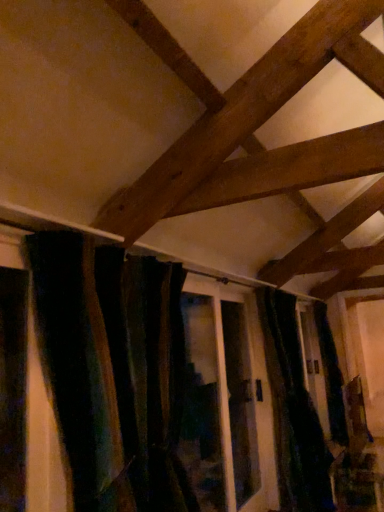
You are a GUI agent. You are given a task and a screenshot of the screen. Output one action in this format:
    pyautogui.click(x=<x>, y=<y>)
    Task: Click on the translucent glass screen door at center
    The width and height of the screenshot is (384, 512).
    Given the screenshot: What is the action you would take?
    pyautogui.click(x=226, y=401)

Describe the element at coordinates (226, 401) in the screenshot. I see `translucent glass screen door at center` at that location.

What is the approximate width of velvet dark green curtain at center, which is the second curtain in left-to-right order?

19.96 inches.

Locate an element on the screen. The width and height of the screenshot is (384, 512). translucent glass screen door at center is located at coordinates (226, 401).

Between velvet dark green curtain at center, the first curtain when ordered from left to right, and translucent glass screen door at center, which one has larger width?

With larger width is velvet dark green curtain at center, the first curtain when ordered from left to right.

From a real-world perspective, does velvet dark green curtain at center, the first curtain when ordered from left to right, sit lower than translucent glass screen door at center?

No, from a real-world perspective, velvet dark green curtain at center, the first curtain when ordered from left to right, is not beneath translucent glass screen door at center.

From the image's perspective, is velvet dark green curtain at center, the first curtain when ordered from left to right, positioned above or below translucent glass screen door at center?

Clearly, from the image's perspective, velvet dark green curtain at center, the first curtain when ordered from left to right, is above translucent glass screen door at center.

Find the location of a particular element. The image size is (384, 512). screen door beneath the velvet dark green curtain at center, the 1th curtain positioned from the front (from a real-world perspective) is located at coordinates (226, 401).

Is velvet dark green curtain at center, which ranks as the first curtain in back-to-front order, far away from velvet dark green curtain at center, which is the 2th curtain from back to front?

velvet dark green curtain at center, which ranks as the first curtain in back-to-front order, is positioned a significant distance from velvet dark green curtain at center, which is the 2th curtain from back to front.

From the picture: Which object is more forward, velvet dark green curtain at center, acting as the second curtain starting from the front, or velvet dark green curtain at center, the first curtain when ordered from left to right?

velvet dark green curtain at center, the first curtain when ordered from left to right, is closer to the camera.

Who is smaller, velvet dark green curtain at center, the 1th curtain viewed from the right, or velvet dark green curtain at center, the first curtain when ordered from left to right?

velvet dark green curtain at center, the first curtain when ordered from left to right, is smaller.

Identify the location of curtain below the velvet dark green curtain at center, which is the 2th curtain from back to front (from the image's perspective). (293, 410).

Between velvet dark green curtain at center, which ranks as the first curtain in back-to-front order, and translucent glass screen door at center, which one appears on the right side from the viewer's perspective?

velvet dark green curtain at center, which ranks as the first curtain in back-to-front order, is more to the right.

From a real-world perspective, which is physically below, velvet dark green curtain at center, the 1th curtain viewed from the right, or translucent glass screen door at center?

velvet dark green curtain at center, the 1th curtain viewed from the right, is physically lower.

Considering the sizes of objects velvet dark green curtain at center, acting as the second curtain starting from the front, and translucent glass screen door at center in the image provided, who is shorter, velvet dark green curtain at center, acting as the second curtain starting from the front, or translucent glass screen door at center?

With less height is translucent glass screen door at center.

In order to click on screen door in front of the velvet dark green curtain at center, which ranks as the first curtain in back-to-front order in this screenshot , I will do `click(226, 401)`.

From a real-world perspective, is velvet dark green curtain at center, the 1th curtain positioned from the front, on top of velvet dark green curtain at center, which ranks as the first curtain in back-to-front order?

Correct, in the physical world, velvet dark green curtain at center, the 1th curtain positioned from the front, is higher than velvet dark green curtain at center, which ranks as the first curtain in back-to-front order.

From the image's perspective, is velvet dark green curtain at center, which is the second curtain in right-to-left order, beneath velvet dark green curtain at center, the 1th curtain viewed from the right?

No.

Is velvet dark green curtain at center, which is the 2th curtain from back to front, looking in the opposite direction of velvet dark green curtain at center, acting as the second curtain starting from the front?

No, velvet dark green curtain at center, which is the 2th curtain from back to front,'s orientation is not away from velvet dark green curtain at center, acting as the second curtain starting from the front.

From a real-world perspective, which object rests below the other?

velvet dark green curtain at center, the 1th curtain viewed from the right, is physically lower.

Can you confirm if translucent glass screen door at center is bigger than velvet dark green curtain at center, which is the second curtain in left-to-right order?

No.

Is point (272, 476) closer or farther from the camera than point (280, 499)?

Clearly, point (272, 476) is more distant from the camera than point (280, 499).

Who is shorter, translucent glass screen door at center or velvet dark green curtain at center, which is the second curtain in right-to-left order?

With less height is velvet dark green curtain at center, which is the second curtain in right-to-left order.

Does translucent glass screen door at center lie behind velvet dark green curtain at center, which is the 2th curtain from back to front?

Yes, translucent glass screen door at center is behind velvet dark green curtain at center, which is the 2th curtain from back to front.

Is translucent glass screen door at center facing towards velvet dark green curtain at center, which is the second curtain in right-to-left order?

A: No, translucent glass screen door at center is not aimed at velvet dark green curtain at center, which is the second curtain in right-to-left order.

Would you say translucent glass screen door at center is outside velvet dark green curtain at center, the 1th curtain positioned from the front?

Yes, translucent glass screen door at center is outside of velvet dark green curtain at center, the 1th curtain positioned from the front.

I want to click on screen door behind the velvet dark green curtain at center, the first curtain when ordered from left to right, so click(x=226, y=401).

Where is `curtain on the right of velvet dark green curtain at center, the 1th curtain positioned from the front`? The width and height of the screenshot is (384, 512). curtain on the right of velvet dark green curtain at center, the 1th curtain positioned from the front is located at coordinates (293, 410).

Looking at the image, which one is located closer to velvet dark green curtain at center, which is the 2th curtain from back to front, translucent glass screen door at center or velvet dark green curtain at center, acting as the second curtain starting from the front?

The object closer to velvet dark green curtain at center, which is the 2th curtain from back to front, is translucent glass screen door at center.

Looking at the image, which one is located closer to velvet dark green curtain at center, which is the second curtain in left-to-right order, velvet dark green curtain at center, which is the 2th curtain from back to front, or translucent glass screen door at center?

The object closer to velvet dark green curtain at center, which is the second curtain in left-to-right order, is translucent glass screen door at center.

Considering their positions, is velvet dark green curtain at center, the 1th curtain viewed from the right, positioned closer to velvet dark green curtain at center, which is the 2th curtain from back to front, than translucent glass screen door at center?

The object closer to velvet dark green curtain at center, which is the 2th curtain from back to front, is translucent glass screen door at center.

When comparing their distances from velvet dark green curtain at center, the 1th curtain viewed from the right, does translucent glass screen door at center or velvet dark green curtain at center, the 1th curtain positioned from the front, seem closer?

translucent glass screen door at center lies closer to velvet dark green curtain at center, the 1th curtain viewed from the right, than the other object.

Which object lies nearer to the anchor point translucent glass screen door at center, velvet dark green curtain at center, which is the second curtain in left-to-right order, or velvet dark green curtain at center, which is the second curtain in right-to-left order?

The object closer to translucent glass screen door at center is velvet dark green curtain at center, which is the second curtain in left-to-right order.

Estimate the real-world distances between objects in this image. Which object is closer to translucent glass screen door at center, velvet dark green curtain at center, which is the 2th curtain from back to front, or velvet dark green curtain at center, acting as the second curtain starting from the front?

velvet dark green curtain at center, acting as the second curtain starting from the front, lies closer to translucent glass screen door at center than the other object.

You are a GUI agent. You are given a task and a screenshot of the screen. Output one action in this format:
    pyautogui.click(x=<x>, y=<y>)
    Task: Click on the screen door located between velvet dark green curtain at center, which is the second curtain in right-to-left order, and velvet dark green curtain at center, acting as the second curtain starting from the front, in the depth direction
    
    Given the screenshot: What is the action you would take?
    pyautogui.click(x=226, y=401)